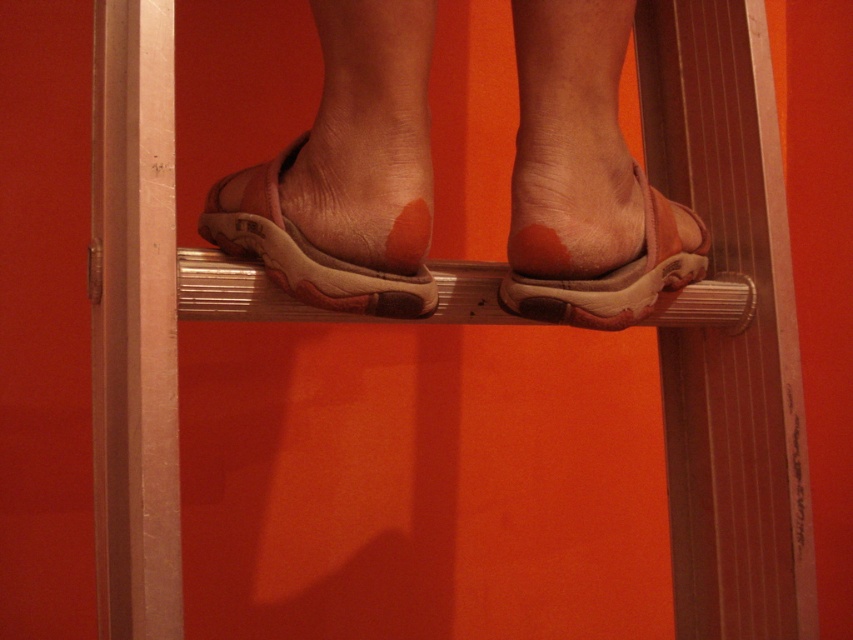
Question: Which point is farther from the camera taking this photo?

Choices:
 (A) (625, 216)
 (B) (575, 317)

Answer: (A)

Question: Does leather sandals at center appear on the left side of brown suede sandal at center?

Choices:
 (A) yes
 (B) no

Answer: (A)

Question: Which object is the closest to the leather sandal at center?

Choices:
 (A) brown suede sandal at center
 (B) leather sandals at center

Answer: (B)

Question: Which of these objects is positioned farthest from the leather sandals at center?

Choices:
 (A) leather sandal at center
 (B) brown suede sandal at center

Answer: (A)

Question: Is leather sandals at center to the right of brown suede sandal at center from the viewer's perspective?

Choices:
 (A) yes
 (B) no

Answer: (B)

Question: Observing the image, what is the correct spatial positioning of leather sandals at center in reference to brown suede sandal at center?

Choices:
 (A) right
 (B) left

Answer: (B)